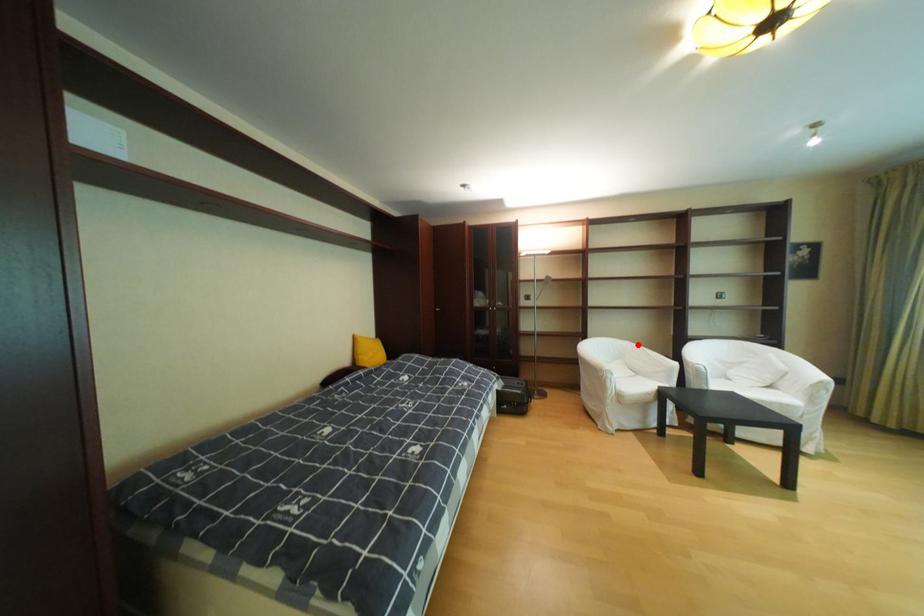
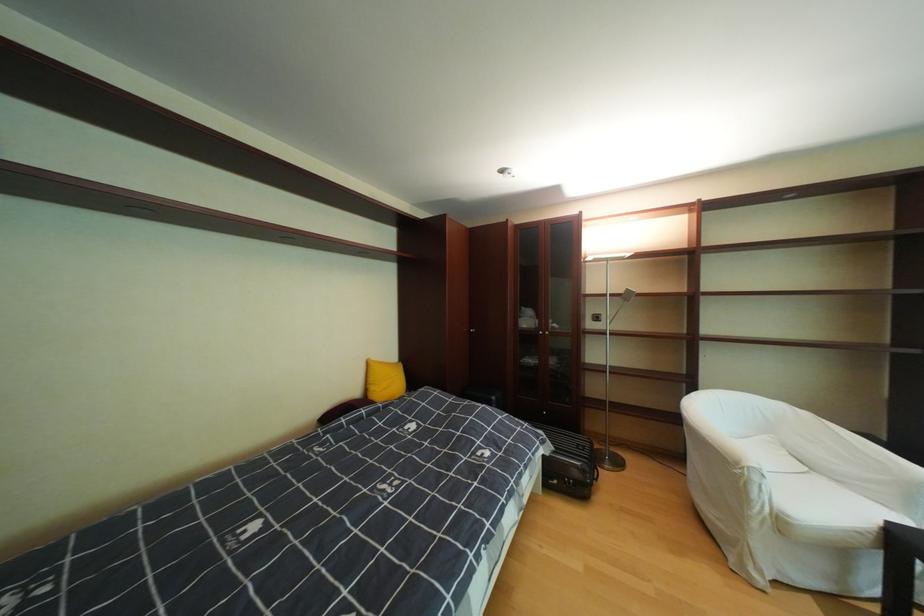
Question: I am providing you with two images of the same scene from different viewpoints. Given a red point in image1, look at the same physical point in image2. Is it:

Choices:
 (A) Closer to the viewpoint
 (B) Farther from the viewpoint

Answer: (A)